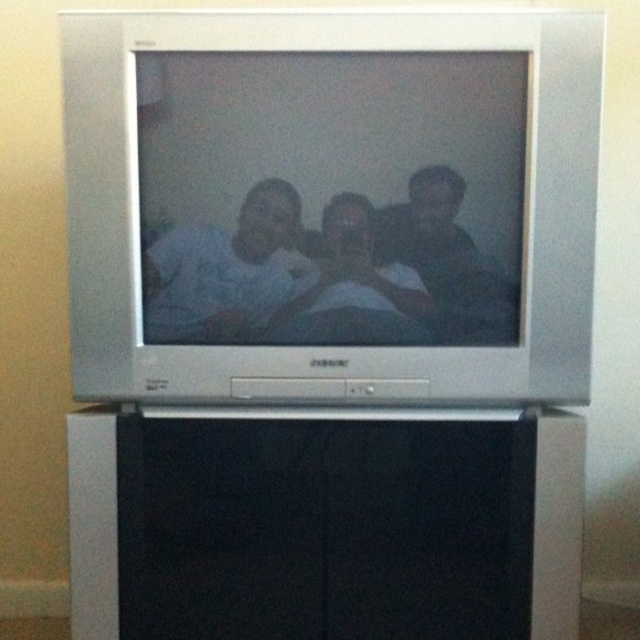
Which is more to the right, silver metallic flat at center or white matte shirt at center?

silver metallic flat at center is more to the right.

Find the location of a particular element. The height and width of the screenshot is (640, 640). silver metallic flat at center is located at coordinates (332, 205).

At what (x,y) coordinates should I click in order to perform the action: click on silver metallic flat at center. Please return your answer as a coordinate pair (x, y). The image size is (640, 640). Looking at the image, I should click on (332, 205).

Between white matte shirt at center and matte white shirt at center, which one appears on the left side from the viewer's perspective?

white matte shirt at center

Who is shorter, white matte shirt at center or matte white shirt at center?

Standing shorter between the two is matte white shirt at center.

Between point (164, 234) and point (385, 339), which one is positioned behind?

The point (385, 339) is behind.

Where is `white matte shirt at center`? white matte shirt at center is located at coordinates (224, 273).

Does silver metallic flat at center have a greater height compared to matte white shirt at center?

Indeed, silver metallic flat at center has a greater height compared to matte white shirt at center.

Does point (291, 90) come in front of point (294, 321)?

Yes.

Identify the location of silver metallic flat at center. (332, 205).